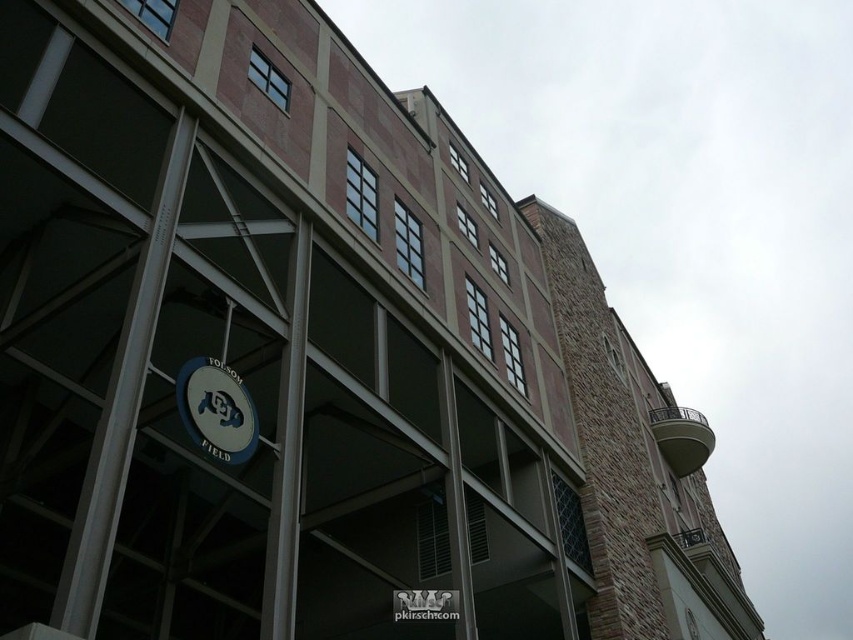
Between point (216, 378) and point (408, 612), which one is positioned behind?

Point (408, 612)

Does matte white sign at center-left appear on the left side of matte black sign at center?

Yes, matte white sign at center-left is to the left of matte black sign at center.

Is point (238, 410) less distant than point (395, 609)?

Yes, it is.

The width and height of the screenshot is (853, 640). What are the coordinates of `matte white sign at center-left` in the screenshot? It's located at (216, 410).